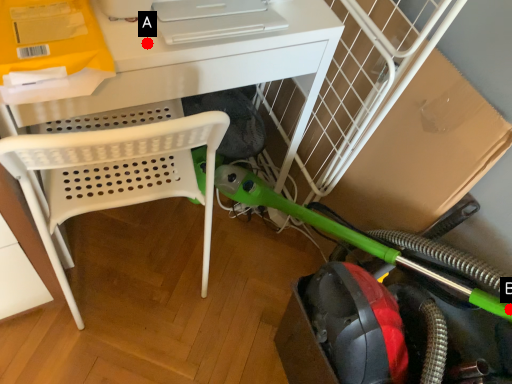
Question: Two points are circled on the image, labeled by A and B beside each circle. Which point is closer to the camera?

Choices:
 (A) A is closer
 (B) B is closer

Answer: (B)